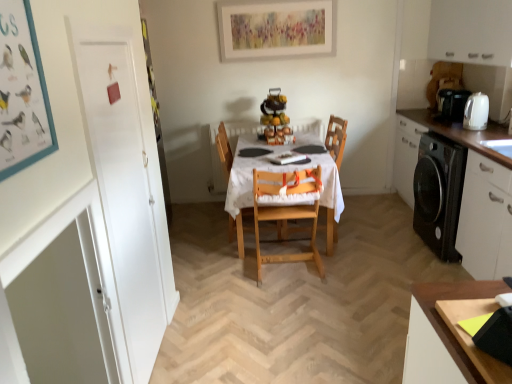
Image resolution: width=512 pixels, height=384 pixels. What are the coordinates of `free space in front of natural wood highchair at center, the 2th chair positioned from the back` in the screenshot? It's located at (300, 295).